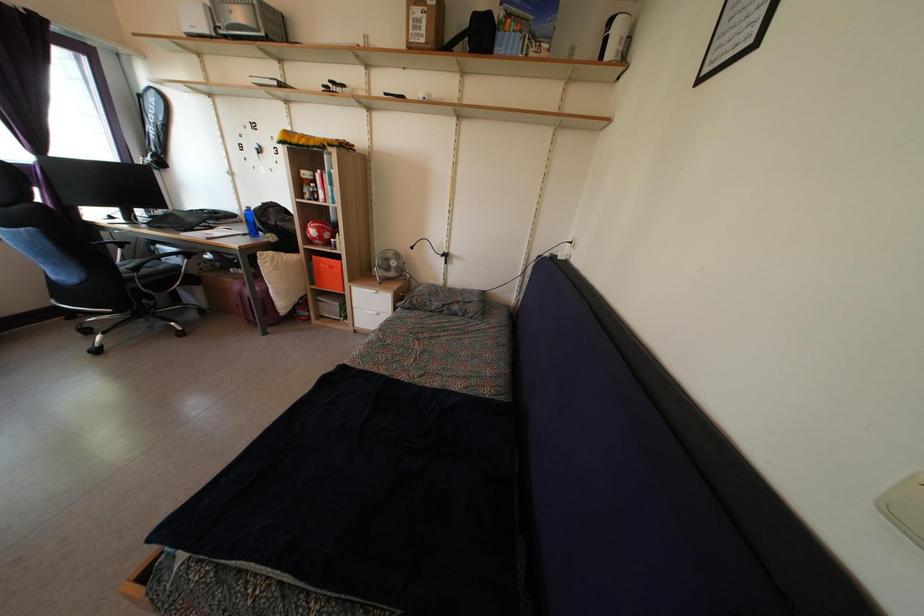
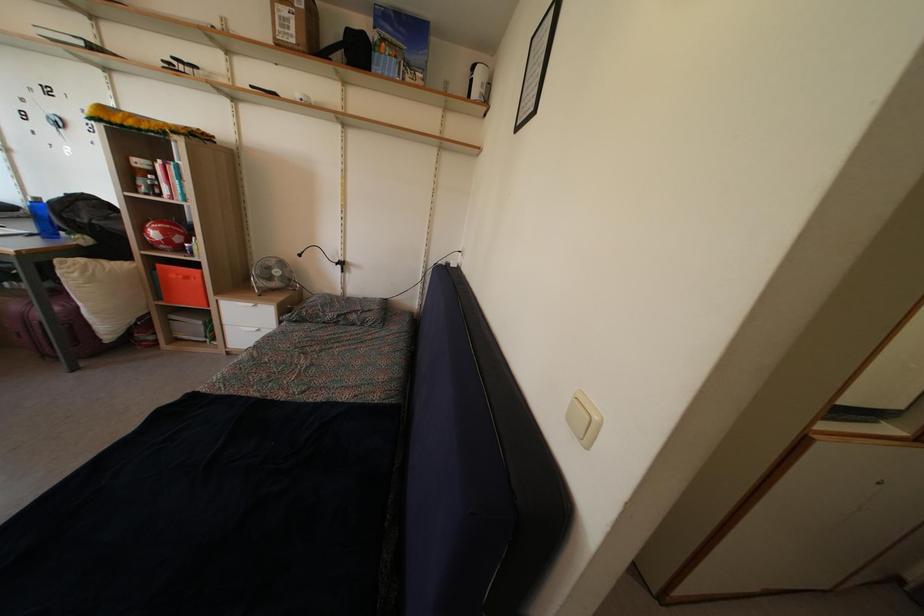
Where in the second image is the point corresponding to [396,272] from the first image?

(280, 281)